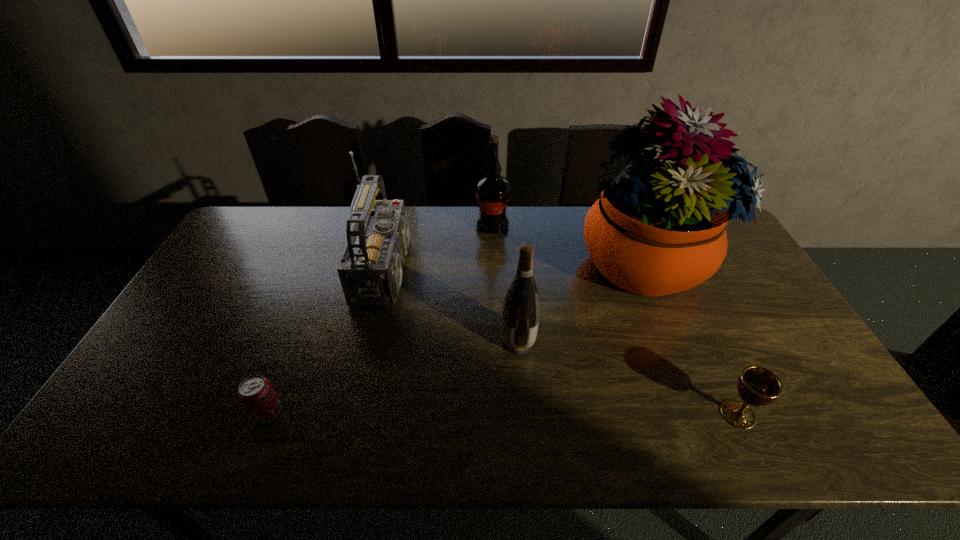
Identify the location of vacant region between the flower arrangement and the soda. The image size is (960, 540). (454, 338).

Find the location of a particular element. The image size is (960, 540). free space between the fifth object from right to left and the leftmost object is located at coordinates (330, 341).

Locate an element on the screen. The height and width of the screenshot is (540, 960). unoccupied area between the radio receiver and the soda is located at coordinates (330, 341).

Image resolution: width=960 pixels, height=540 pixels. In order to click on free spot between the leftmost object and the radio receiver in this screenshot , I will do `click(330, 341)`.

Where is `free space between the third nearest object and the chalice`? free space between the third nearest object and the chalice is located at coordinates (628, 378).

Where is `unoccupied area between the tallest object and the second object from left to right`? This screenshot has width=960, height=540. unoccupied area between the tallest object and the second object from left to right is located at coordinates (516, 266).

The width and height of the screenshot is (960, 540). I want to click on vacant point located between the leftmost object and the tallest object, so click(454, 338).

Identify the location of unoccupied area between the radio receiver and the third nearest object. The image size is (960, 540). (455, 305).

Select which object is the fifth closest to the radio receiver. Please provide its 2D coordinates. Your answer should be formatted as a tuple, i.e. [(x, y)], where the tuple contains the x and y coordinates of a point satisfying the conditions above.

[(757, 386)]

Choose which object is the second nearest neighbor to the farther wine bottle. Please provide its 2D coordinates. Your answer should be formatted as a tuple, i.e. [(x, y)], where the tuple contains the x and y coordinates of a point satisfying the conditions above.

[(658, 228)]